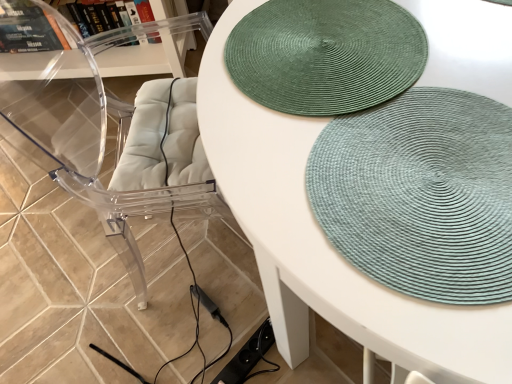
This screenshot has height=384, width=512. Find the location of `vacant space situated above green woven mat at upper center, the 2th mat ordered from the bottom (from a real-world perspective)`. vacant space situated above green woven mat at upper center, the 2th mat ordered from the bottom (from a real-world perspective) is located at coordinates (330, 48).